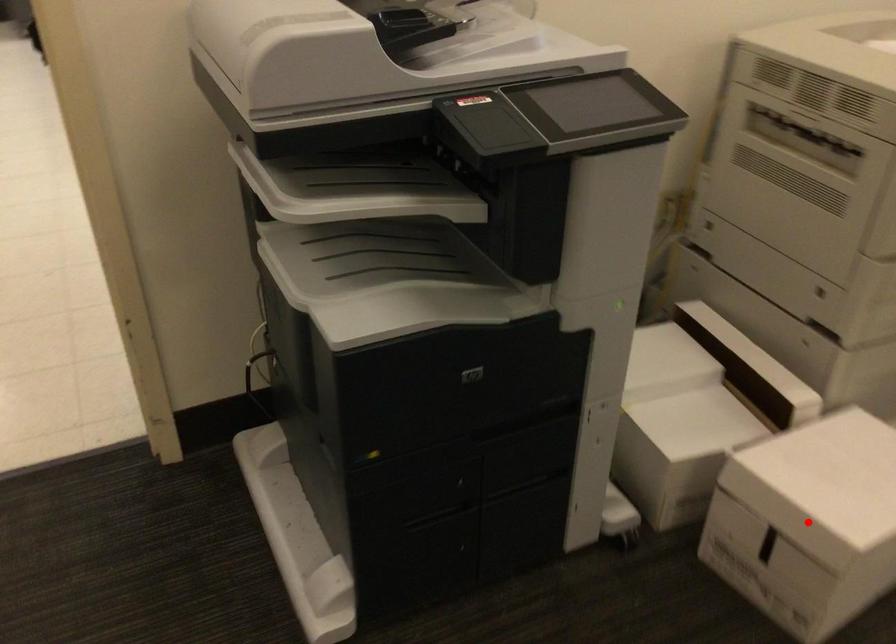
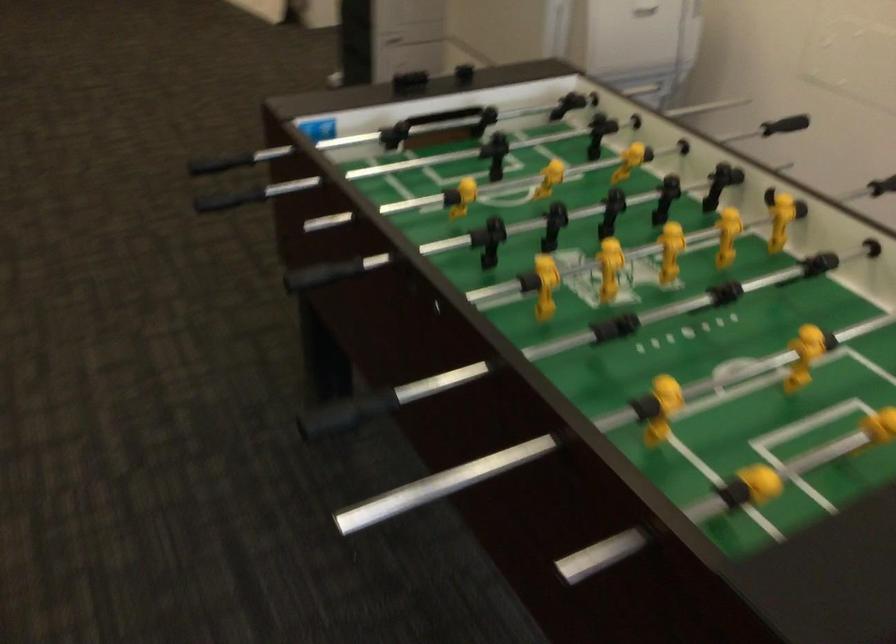
Question: I am providing you with two images of the same scene from different viewpoints. A red point is marked on the first image. Is the red point's position out of view in image 2?

Choices:
 (A) Yes
 (B) No

Answer: (A)